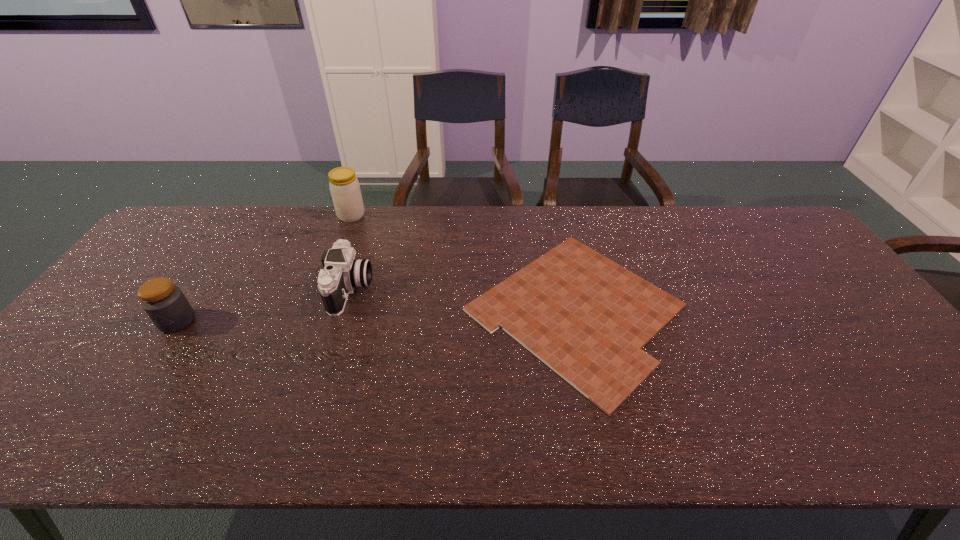
You are a GUI agent. You are given a task and a screenshot of the screen. Output one action in this format:
    pyautogui.click(x=<x>, y=<y>)
    Task: Click on the blank region between the rightmost object and the right jar
    This screenshot has width=960, height=540.
    Given the screenshot: What is the action you would take?
    pyautogui.click(x=463, y=263)

You are a GUI agent. You are given a task and a screenshot of the screen. Output one action in this format:
    pyautogui.click(x=<x>, y=<y>)
    Task: Click on the vacant space that is in between the tallest object and the nearer jar
    This screenshot has height=540, width=960.
    Given the screenshot: What is the action you would take?
    pyautogui.click(x=264, y=268)

Identify the location of free space between the camera and the rightmost object. The height and width of the screenshot is (540, 960). (463, 300).

The width and height of the screenshot is (960, 540). What are the coordinates of `vacant space that's between the camera and the left jar` in the screenshot? It's located at (264, 305).

Find the location of a particular element. Image resolution: width=960 pixels, height=540 pixels. free point between the camera and the gameboard is located at coordinates (463, 300).

Find the location of a particular element. This screenshot has width=960, height=540. blank region between the camera and the shortest object is located at coordinates (463, 300).

Image resolution: width=960 pixels, height=540 pixels. I want to click on empty location between the camera and the gameboard, so click(463, 300).

Find the location of a particular element. Image resolution: width=960 pixels, height=540 pixels. object that ranks as the closest to the rightmost object is located at coordinates (342, 273).

Locate an element on the screen. Image resolution: width=960 pixels, height=540 pixels. object that is the third closest to the right jar is located at coordinates (166, 305).

Identify the location of vacant region that satisfies the following two spatial constraints: 1. on the front side of the shortest object; 2. on the left side of the right jar. (317, 310).